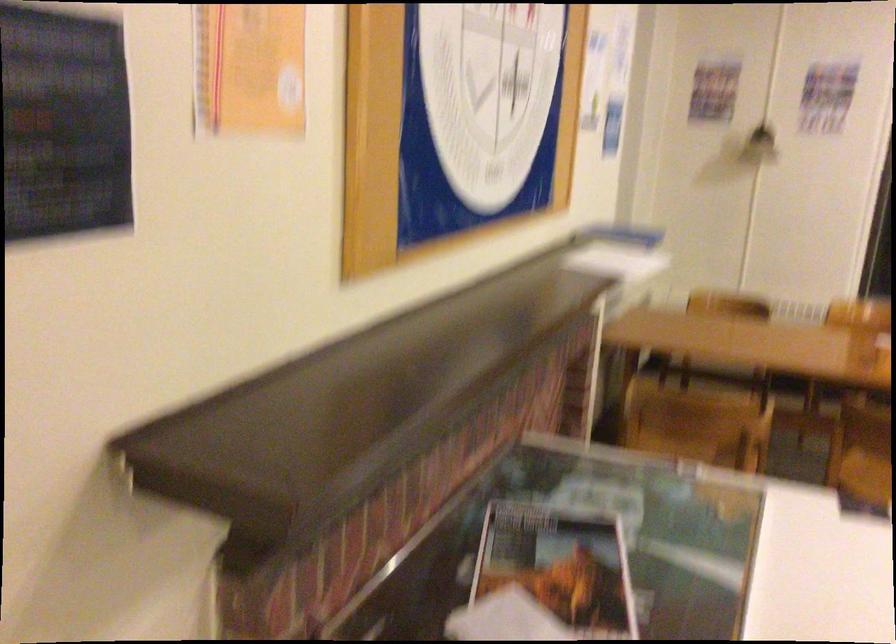
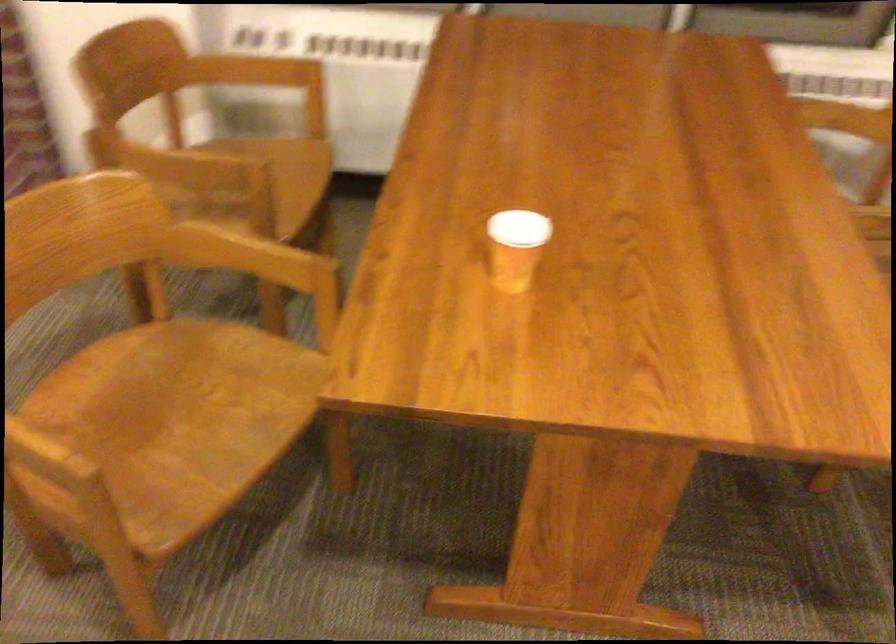
Where in the second image is the point corresponding to the point at 739,410 from the first image?

(169, 163)